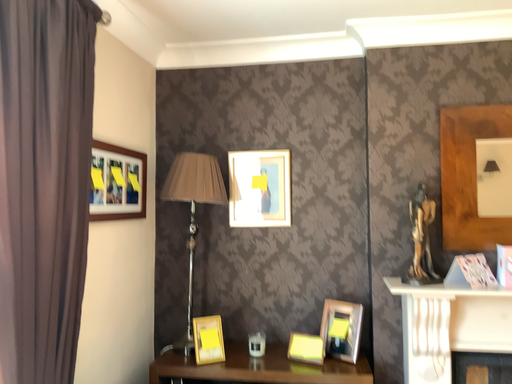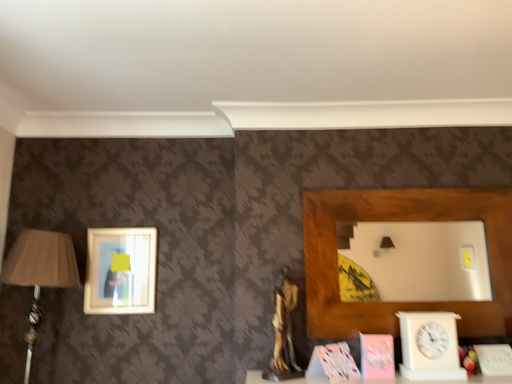
Question: How did the camera likely rotate when shooting the video?

Choices:
 (A) rotated downward
 (B) rotated upward

Answer: (B)